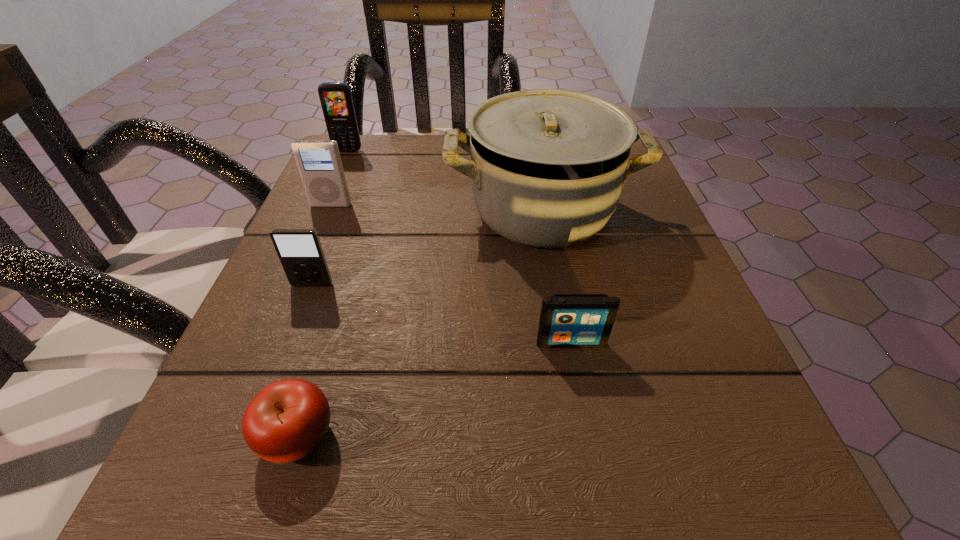
Where is `empty space that is in between the apple and the third shortest object`? empty space that is in between the apple and the third shortest object is located at coordinates (305, 361).

Where is `vacant space that is in between the third nearest object and the fourth shortest object`? This screenshot has height=540, width=960. vacant space that is in between the third nearest object and the fourth shortest object is located at coordinates (322, 245).

Identify the location of object that is the fifth closest to the apple. (336, 100).

Choose which object is the third nearest neighbor to the cellular telephone. Please provide its 2D coordinates. Your answer should be formatted as a tuple, i.e. [(x, y)], where the tuple contains the x and y coordinates of a point satisfying the conditions above.

[(300, 252)]

This screenshot has height=540, width=960. I want to click on the closest iPod to the saucepan, so click(566, 320).

Find the location of `iPod that is the nearest to the cellular telephone`. iPod that is the nearest to the cellular telephone is located at coordinates (319, 162).

Where is `vacant space that satisfies the following two spatial constraints: 1. on the front-facing side of the saucepan; 2. on the right side of the tallest iPod`? The image size is (960, 540). vacant space that satisfies the following two spatial constraints: 1. on the front-facing side of the saucepan; 2. on the right side of the tallest iPod is located at coordinates (328, 211).